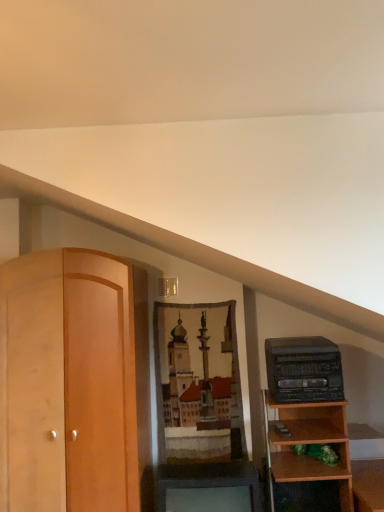
Question: Does point (160, 495) appear closer or farther from the camera than point (271, 378)?

Choices:
 (A) closer
 (B) farther

Answer: (A)

Question: In the image, is matte black cabinet at lower center on the left side or the right side of black plastic stereo at right?

Choices:
 (A) left
 (B) right

Answer: (A)

Question: Considering the positions of matte black cabinet at lower center and black plastic stereo at right in the image, is matte black cabinet at lower center bigger or smaller than black plastic stereo at right?

Choices:
 (A) small
 (B) big

Answer: (B)

Question: Looking at their shapes, would you say black plastic stereo at right is wider or thinner than matte black cabinet at lower center?

Choices:
 (A) wide
 (B) thin

Answer: (B)

Question: Choose the correct answer: Is black plastic stereo at right inside matte black cabinet at lower center or outside it?

Choices:
 (A) inside
 (B) outside

Answer: (B)

Question: Visually, is black plastic stereo at right positioned to the left or to the right of matte black cabinet at lower center?

Choices:
 (A) right
 (B) left

Answer: (A)

Question: Does point (302, 369) appear closer or farther from the camera than point (163, 478)?

Choices:
 (A) farther
 (B) closer

Answer: (A)